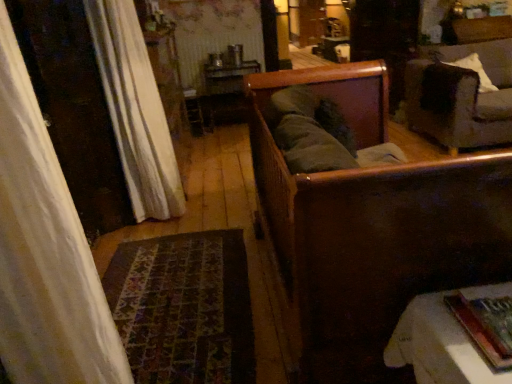
The width and height of the screenshot is (512, 384). Find the location of `empty space that is ontop of white fabric tablecloth at lower right, which is the 1th furniture from back to front`. empty space that is ontop of white fabric tablecloth at lower right, which is the 1th furniture from back to front is located at coordinates (456, 331).